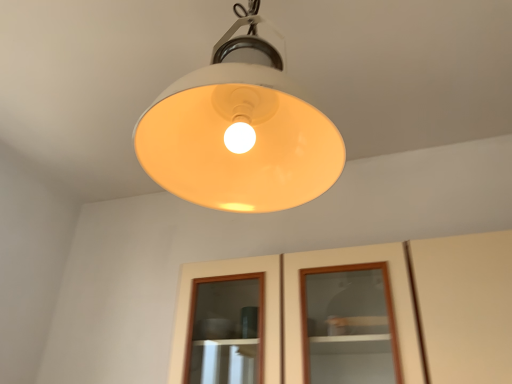
Image resolution: width=512 pixels, height=384 pixels. Describe the element at coordinates (239, 131) in the screenshot. I see `matte white lampshade at center` at that location.

Locate an element on the screen. matte white lampshade at center is located at coordinates (239, 131).

What is the approximate height of matte white lampshade at center?

The height of matte white lampshade at center is 26.16 inches.

I want to click on matte white lampshade at center, so click(x=239, y=131).